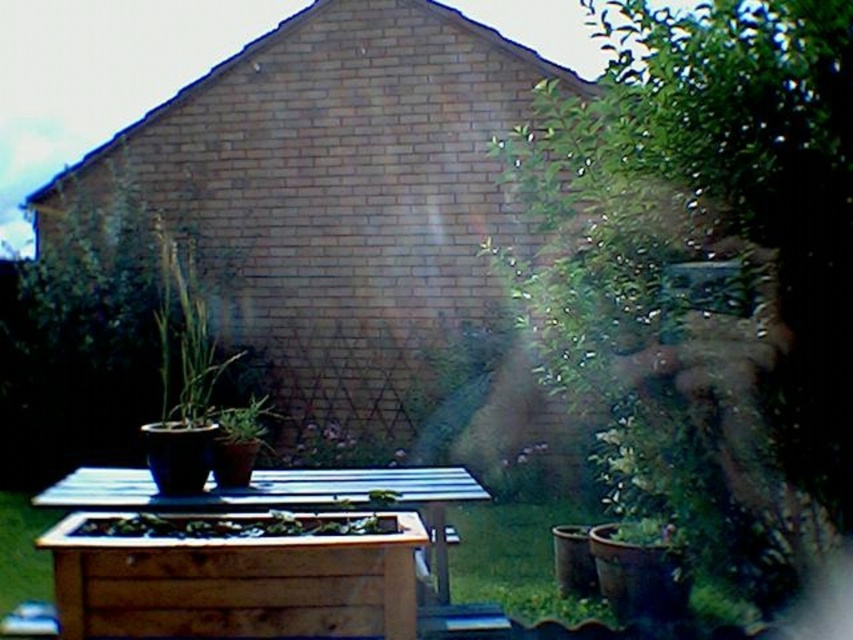
Is wooden planter at lower center shorter than wooden planter at center?

Yes.

Between wooden planter at lower center and wooden planter at center, which one has more height?

Standing taller between the two is wooden planter at center.

You are a GUI agent. You are given a task and a screenshot of the screen. Output one action in this format:
    pyautogui.click(x=<x>, y=<y>)
    Task: Click on the wooden planter at lower center
    This screenshot has width=853, height=640.
    Given the screenshot: What is the action you would take?
    pyautogui.click(x=234, y=582)

The image size is (853, 640). Find the location of `wooden planter at lower center`. wooden planter at lower center is located at coordinates (234, 582).